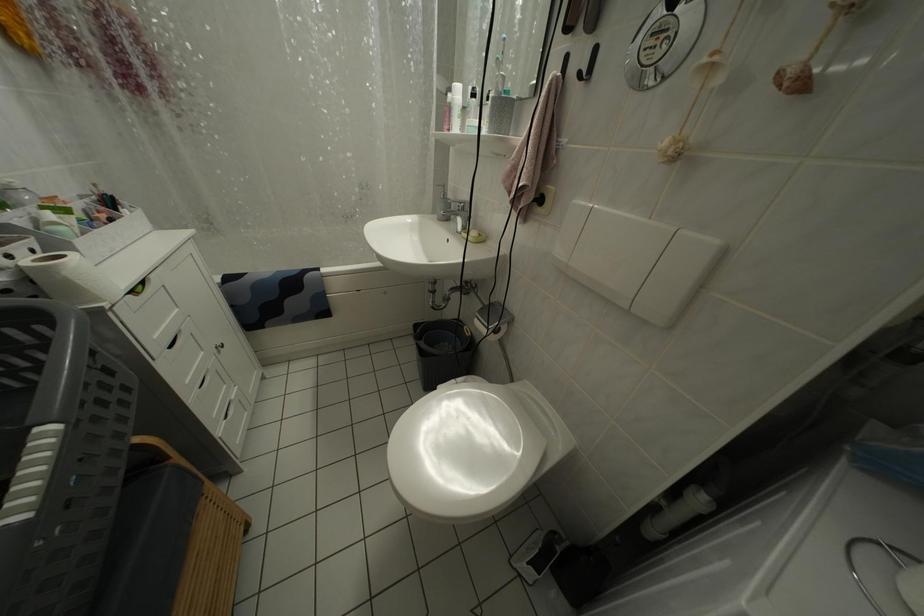
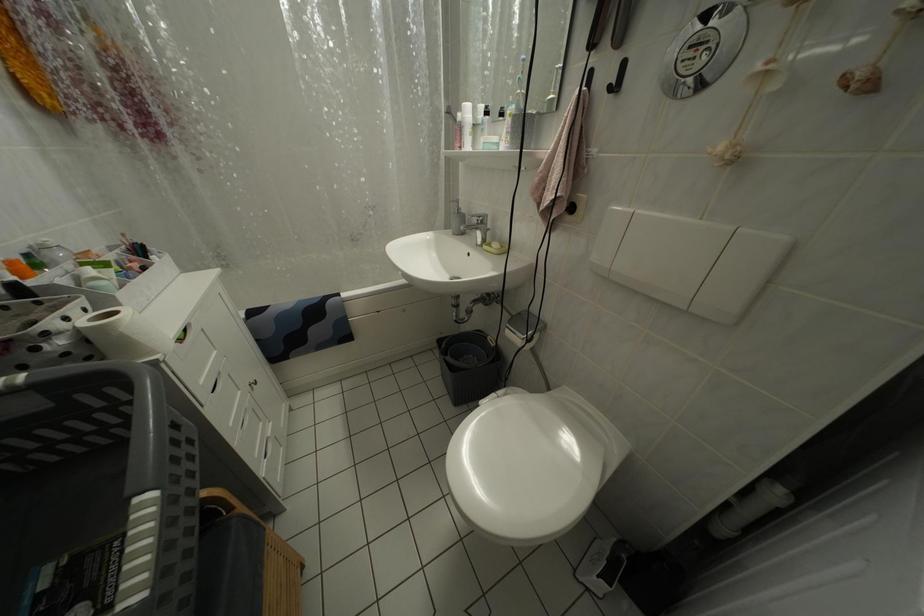
Question: The first image is from the beginning of the video and the second image is from the end. How did the camera likely rotate when shooting the video?

Choices:
 (A) Left
 (B) Right
 (C) Up
 (D) Down

Answer: (C)